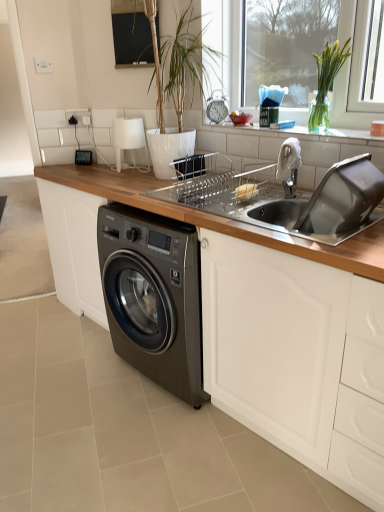
The height and width of the screenshot is (512, 384). I want to click on empty space that is ontop of white glossy window sill at upper center, so click(x=281, y=128).